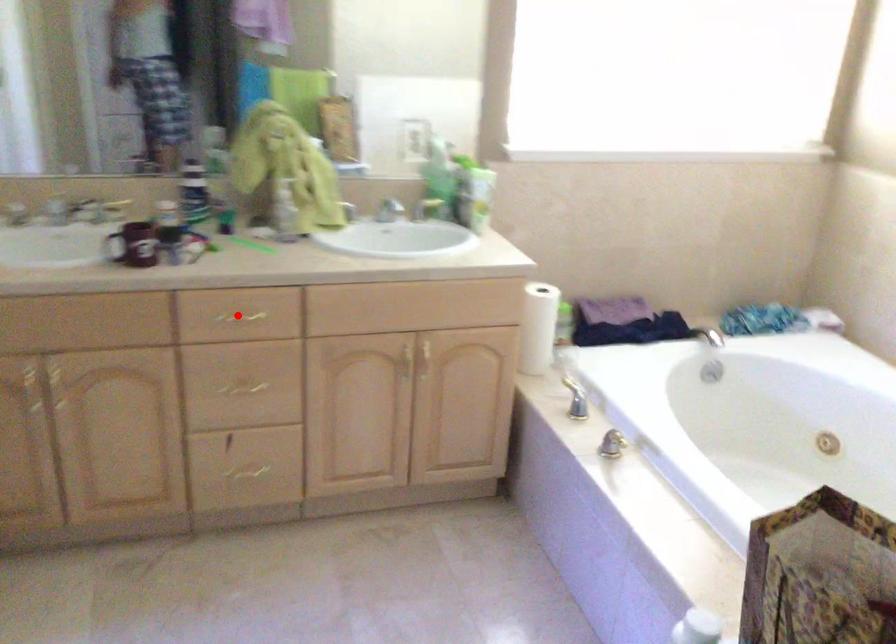
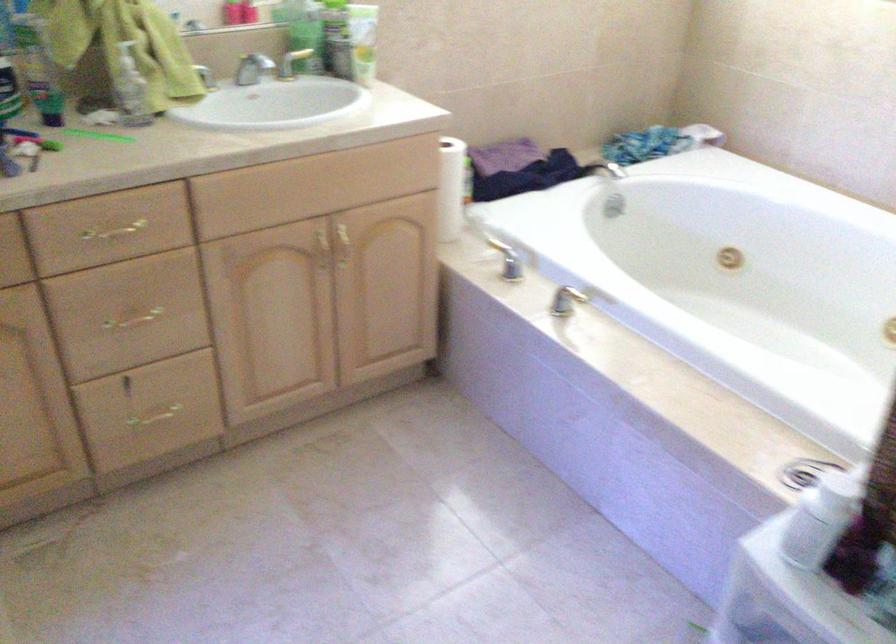
Question: A red point is marked in image1. In image2, is the corresponding 3D point closer to the camera or farther? Reply with the corresponding letter.

Choices:
 (A) The corresponding 3D point is closer.
 (B) The corresponding 3D point is farther.

Answer: (A)